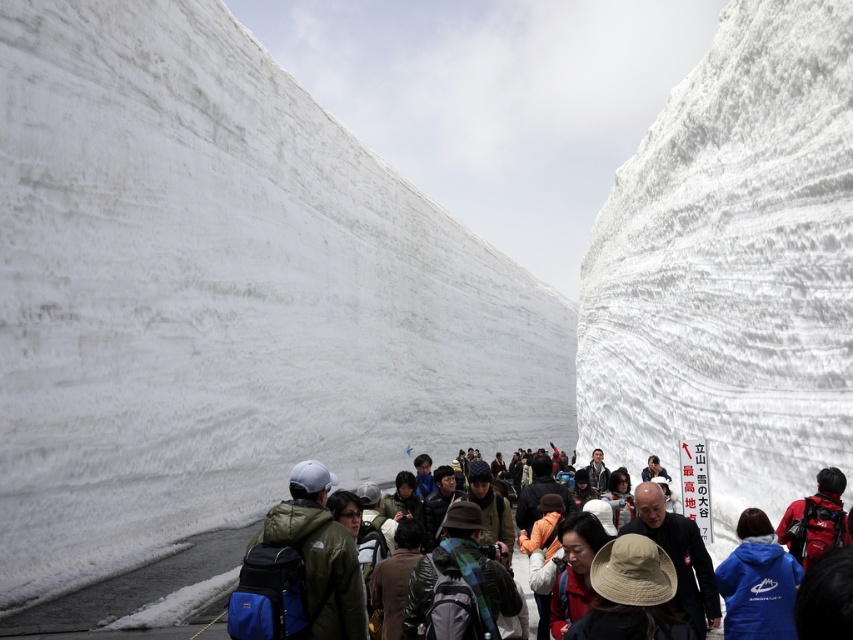
Does beige straw hat at center appear on the right side of red fabric hat at center?

No, beige straw hat at center is not to the right of red fabric hat at center.

In the scene shown: Can you confirm if beige straw hat at center is taller than red fabric hat at center?

Correct, beige straw hat at center is much taller as red fabric hat at center.

Which is behind, point (618, 584) or point (555, 588)?

The point (555, 588) is more distant.

Locate an element on the screen. The image size is (853, 640). beige straw hat at center is located at coordinates (631, 595).

Is white fluffy snow at center wider than red fabric hat at center?

Yes, white fluffy snow at center is wider than red fabric hat at center.

Is point (125, 141) farther from viewer compared to point (572, 518)?

Yes.

The height and width of the screenshot is (640, 853). Describe the element at coordinates (222, 296) in the screenshot. I see `white fluffy snow at center` at that location.

You are a GUI agent. You are given a task and a screenshot of the screen. Output one action in this format:
    pyautogui.click(x=<x>, y=<y>)
    Task: Click on the white fluffy snow at center
    The height and width of the screenshot is (640, 853).
    Given the screenshot: What is the action you would take?
    pyautogui.click(x=222, y=296)

You are a GUI agent. You are given a task and a screenshot of the screen. Output one action in this format:
    pyautogui.click(x=<x>, y=<y>)
    Task: Click on the plaid fabric hat at center
    The height and width of the screenshot is (640, 853).
    Given the screenshot: What is the action you would take?
    pyautogui.click(x=457, y=582)

Based on the photo, can you confirm if plaid fabric hat at center is taller than red fabric hat at center?

Yes, plaid fabric hat at center is taller than red fabric hat at center.

Is point (468, 518) more distant than point (566, 582)?

Yes, it is behind point (566, 582).

Image resolution: width=853 pixels, height=640 pixels. In order to click on plaid fabric hat at center in this screenshot , I will do `click(457, 582)`.